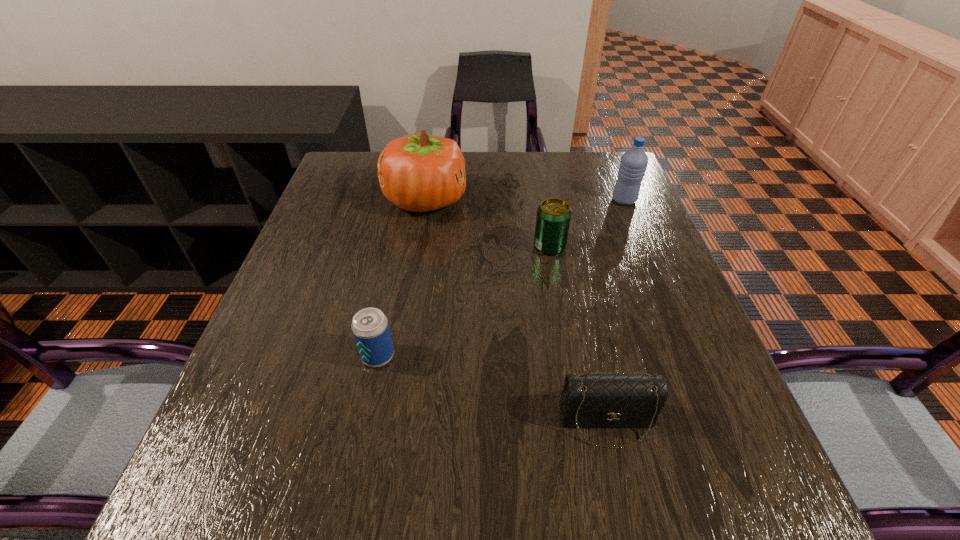
In the image, there is a desktop. In order to click on vacant space at the right edge in this screenshot , I will do `click(652, 447)`.

Where is `vacant space at the far left corner of the desktop`? vacant space at the far left corner of the desktop is located at coordinates (346, 165).

This screenshot has height=540, width=960. In the image, there is a desktop. Find the location of `vacant space at the far right corner`. vacant space at the far right corner is located at coordinates (600, 164).

In the image, there is a desktop. Identify the location of free space at the near right corner. (693, 492).

You are a GUI agent. You are given a task and a screenshot of the screen. Output one action in this format:
    pyautogui.click(x=<x>, y=<y>)
    Task: Click on the unoccupied position between the fourth farthest object and the clutch bag
    The width and height of the screenshot is (960, 540).
    Given the screenshot: What is the action you would take?
    pyautogui.click(x=492, y=389)

Locate an element on the screen. empty location between the water bottle and the second nearest object is located at coordinates (501, 278).

Identify the location of free point between the farther beer can and the pumpkin. The width and height of the screenshot is (960, 540). (488, 223).

You are a GUI agent. You are given a task and a screenshot of the screen. Output one action in this format:
    pyautogui.click(x=<x>, y=<y>)
    Task: Click on the free space between the pumpkin and the second nearest object
    This screenshot has width=960, height=540.
    Given the screenshot: What is the action you would take?
    (x=401, y=278)

This screenshot has width=960, height=540. Identify the location of vacant area that lies between the farther beer can and the nearer beer can. (464, 301).

Identify the location of free point between the pumpkin and the second nearest object. (401, 278).